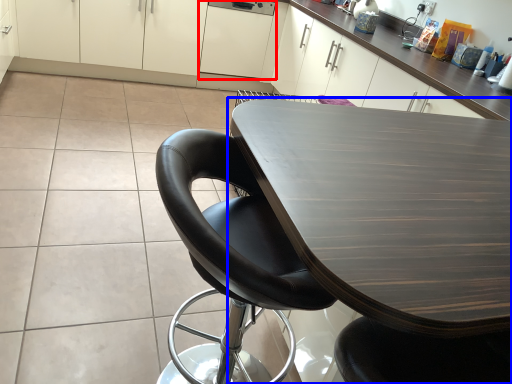
Question: Which of the following is the farthest to the observer, cabinetry (highlighted by a red box) or table (highlighted by a blue box)?

Choices:
 (A) cabinetry
 (B) table

Answer: (A)